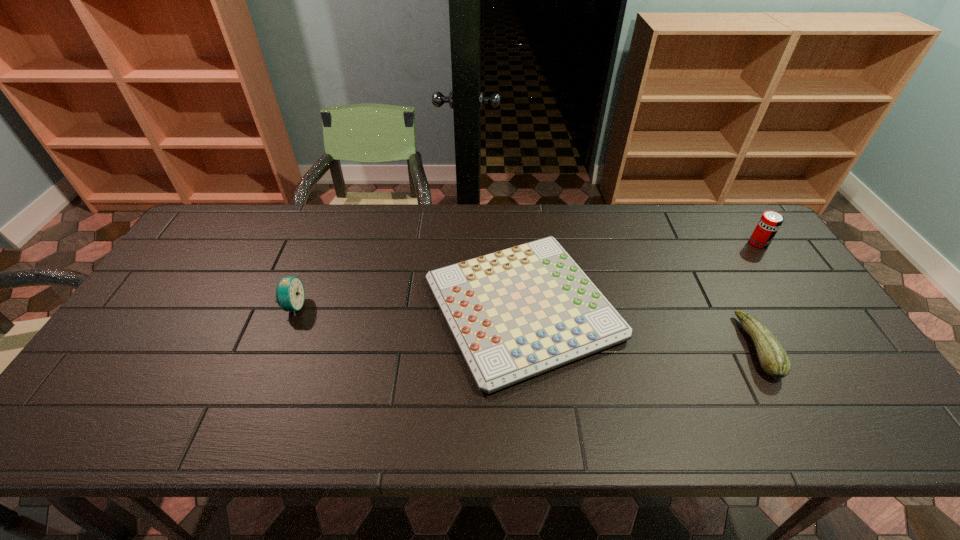
This screenshot has height=540, width=960. In the image, there is a desktop. Identify the location of vacant space at the far left corner. (228, 225).

In the image, there is a desktop. Identify the location of vacant space at the near left corner. Image resolution: width=960 pixels, height=540 pixels. (81, 435).

Locate an element on the screen. Image resolution: width=960 pixels, height=540 pixels. unoccupied area between the can and the gameboard is located at coordinates (640, 275).

At what (x,y) coordinates should I click in order to perform the action: click on free space between the rightmost object and the zucchini. Please return your answer as a coordinate pair (x, y). The height and width of the screenshot is (540, 960). Looking at the image, I should click on (758, 295).

At what (x,y) coordinates should I click in order to perform the action: click on free spot between the second object from right to left and the shortest object. Please return your answer as a coordinate pair (x, y). The width and height of the screenshot is (960, 540). Looking at the image, I should click on (640, 327).

Where is `free space between the alarm clock and the gameboard`? free space between the alarm clock and the gameboard is located at coordinates (408, 307).

Locate an element on the screen. The width and height of the screenshot is (960, 540). free spot between the can and the shortest object is located at coordinates (640, 275).

The image size is (960, 540). I want to click on vacant space in between the alarm clock and the shortest object, so click(x=408, y=307).

The height and width of the screenshot is (540, 960). What are the coordinates of `vacant space that's between the gameboard and the can` in the screenshot? It's located at (640, 275).

Locate an element on the screen. Image resolution: width=960 pixels, height=540 pixels. vacant space that's between the can and the shortest object is located at coordinates (640, 275).